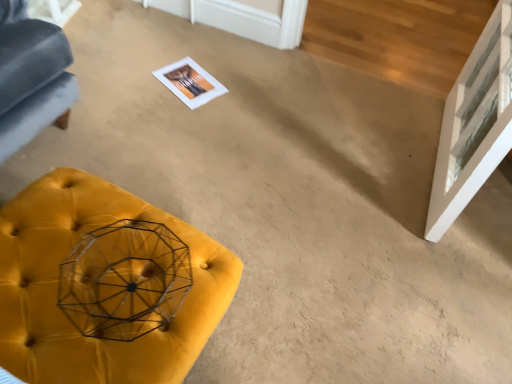
Question: Should I look upward or downward to see velvet yellow ottoman at lower left?

Choices:
 (A) up
 (B) down

Answer: (B)

Question: From the image's perspective, would you say transparent glass door at upper right is positioned over velvet yellow ottoman at lower left?

Choices:
 (A) no
 (B) yes

Answer: (B)

Question: From a real-world perspective, is transparent glass door at upper right below velvet yellow ottoman at lower left?

Choices:
 (A) yes
 (B) no

Answer: (B)

Question: Would you consider transparent glass door at upper right to be distant from velvet yellow ottoman at lower left?

Choices:
 (A) yes
 (B) no

Answer: (B)

Question: Considering the relative sizes of transparent glass door at upper right and velvet yellow ottoman at lower left in the image provided, is transparent glass door at upper right taller than velvet yellow ottoman at lower left?

Choices:
 (A) yes
 (B) no

Answer: (A)

Question: Considering the relative sizes of transparent glass door at upper right and velvet yellow ottoman at lower left in the image provided, is transparent glass door at upper right smaller than velvet yellow ottoman at lower left?

Choices:
 (A) yes
 (B) no

Answer: (B)

Question: Is transparent glass door at upper right facing towards velvet yellow ottoman at lower left?

Choices:
 (A) no
 (B) yes

Answer: (A)

Question: From the image's perspective, is velvet yellow ottoman at lower left over transparent glass door at upper right?

Choices:
 (A) no
 (B) yes

Answer: (A)

Question: Is velvet yellow ottoman at lower left beside transparent glass door at upper right?

Choices:
 (A) yes
 (B) no

Answer: (B)

Question: Is velvet yellow ottoman at lower left positioned beyond the bounds of transparent glass door at upper right?

Choices:
 (A) no
 (B) yes

Answer: (B)

Question: Is transparent glass door at upper right at the back of velvet yellow ottoman at lower left?

Choices:
 (A) no
 (B) yes

Answer: (A)

Question: From the image's perspective, is velvet yellow ottoman at lower left located beneath transparent glass door at upper right?

Choices:
 (A) no
 (B) yes

Answer: (B)

Question: Is velvet yellow ottoman at lower left aimed at transparent glass door at upper right?

Choices:
 (A) yes
 (B) no

Answer: (A)

Question: From their relative heights in the image, would you say transparent glass door at upper right is taller or shorter than velvet yellow ottoman at lower left?

Choices:
 (A) tall
 (B) short

Answer: (A)